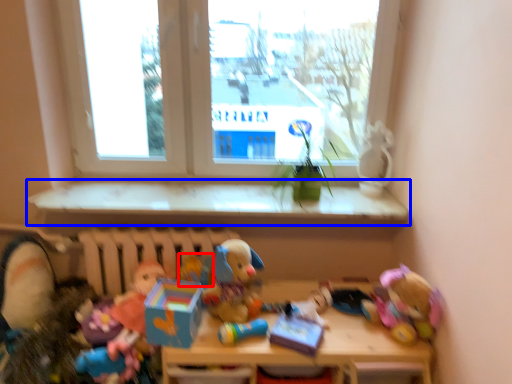
Question: Which of the following is the farthest to the observer, toy (highlighted by a red box) or window sill (highlighted by a blue box)?

Choices:
 (A) toy
 (B) window sill

Answer: (B)